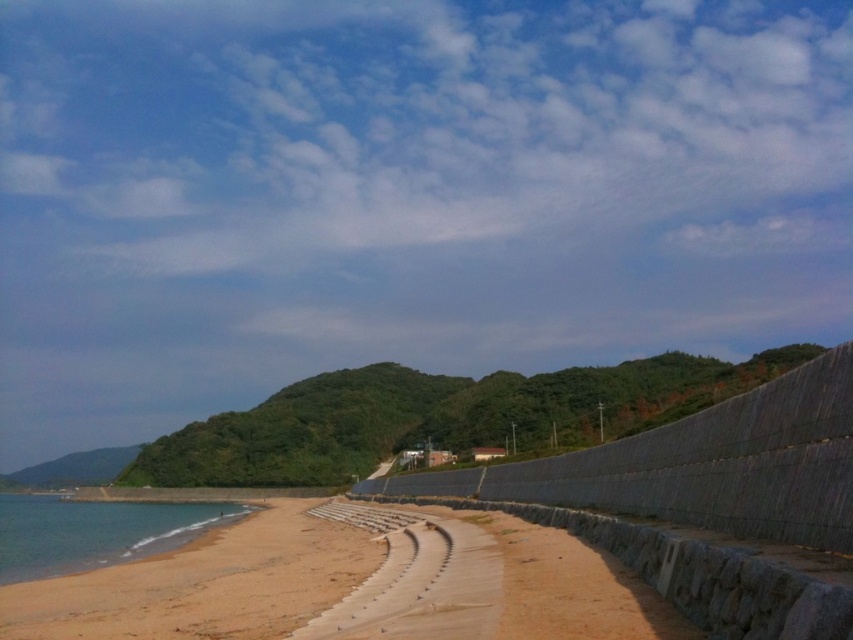
Question: From the image, what is the correct spatial relationship of gray concrete wall at center in relation to clear blue water at lower left?

Choices:
 (A) below
 (B) above

Answer: (B)

Question: Which of the following is the farthest from the observer?

Choices:
 (A) (838, 497)
 (B) (27, 534)
 (C) (77, 604)

Answer: (B)

Question: Which point is closer to the camera?

Choices:
 (A) (822, 497)
 (B) (209, 529)
 (C) (184, 532)

Answer: (A)

Question: Is gray concrete wall at center bigger than brown sandy beach at lower left?

Choices:
 (A) no
 (B) yes

Answer: (B)

Question: Can you confirm if brown sandy beach at lower left is positioned below clear blue water at lower left?

Choices:
 (A) no
 (B) yes

Answer: (A)

Question: Which object appears closest to the camera in this image?

Choices:
 (A) brown sandy beach at lower left
 (B) clear blue water at lower left

Answer: (A)